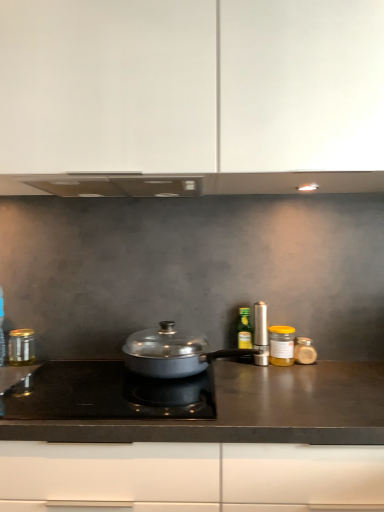
The image size is (384, 512). In order to click on vacant space in front of clear glass jar at left, which appears as the sixth kitchen appliance when viewed from the right in this screenshot , I will do click(x=21, y=371).